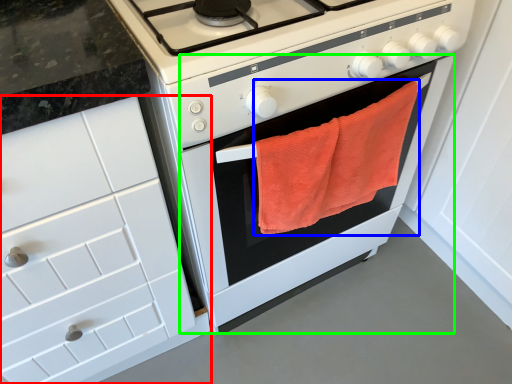
Question: Estimate the real-world distances between objects in this image. Which object is farther from cabinetry (highlighted by a red box), beach towel (highlighted by a blue box) or oven (highlighted by a green box)?

Choices:
 (A) beach towel
 (B) oven

Answer: (A)